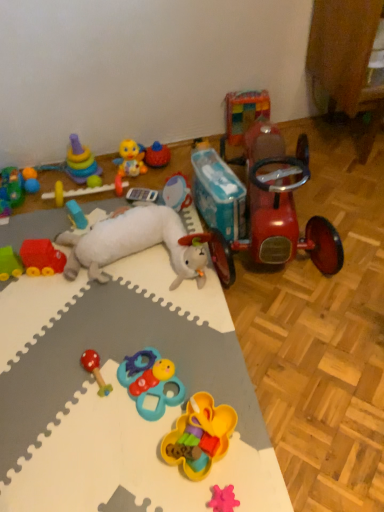
At what (x,y) coordinates should I click in order to perform the action: click on vacant area that lies between plastic drum at center, the ninth toy from the left, and wooden/matte rattle at lower left, marked as the 9th toy in a right-to-left arrangement. Please return your answer as a coordinate pair (x, y). The image size is (384, 512). Looking at the image, I should click on (133, 301).